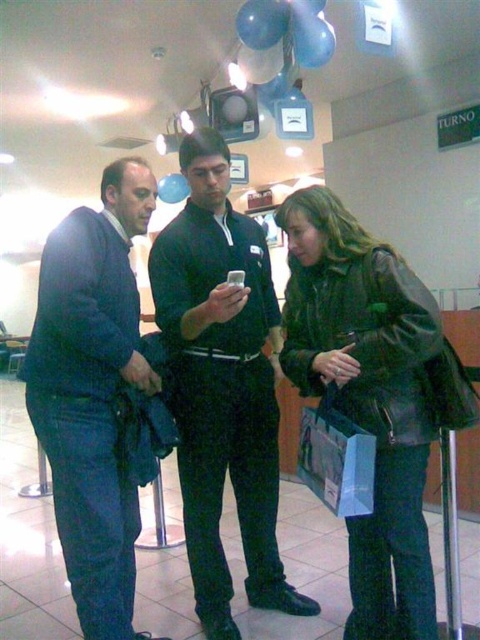
From the picture: You are a security guard in the mall and need to check the IDs of two people. The black smooth shirt at center and the leather jacket at lower right are standing near you. Which one is closer to your left side?

The black smooth shirt at center is positioned on the left side of leather jacket at lower right, so the black smooth shirt at center is closer to your left side.

You are a security guard in the mall. You need to check the height of the black smooth shirt at center and dark blue jeans at center to ensure they meet safety regulations. Which one is taller?

The black smooth shirt at center is taller than dark blue jeans at center.

You are a security guard in the mall and need to check the clothing items of the two people in the image. Which clothing item is closer to you, the black smooth shirt at center or the dark blue jeans at center?

The black smooth shirt at center is closer to you because the dark blue jeans at center is behind it.